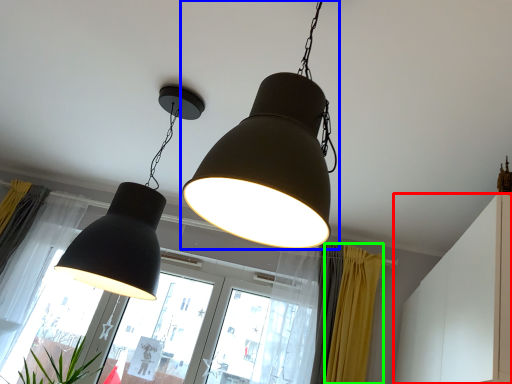
Question: Based on their relative distances, which object is farther from dresser (highlighted by a red box)? Choose from lamp (highlighted by a blue box) and curtain (highlighted by a green box).

Choices:
 (A) lamp
 (B) curtain

Answer: (A)